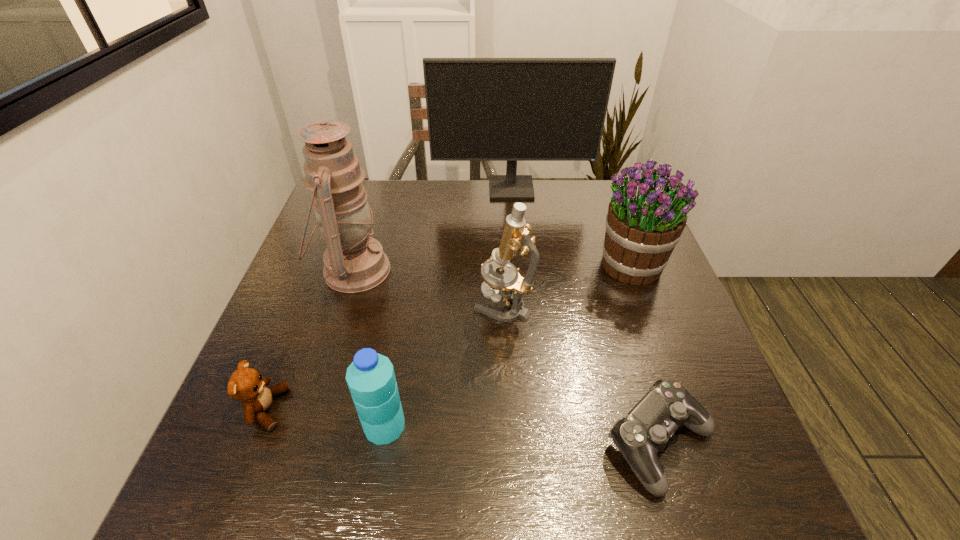
What are the coordinates of `object that ranks as the second closest to the oil lamp` in the screenshot? It's located at (246, 384).

Find the location of a particular element. The width and height of the screenshot is (960, 540). vacant region that satisfies the following two spatial constraints: 1. on the front-facing side of the bouquet; 2. on the right side of the computer monitor is located at coordinates (518, 265).

What are the coordinates of `vacant region that satisfies the following two spatial constraints: 1. on the front-facing side of the computer monitor; 2. on the front-facing side of the sixth tallest object` in the screenshot? It's located at (533, 409).